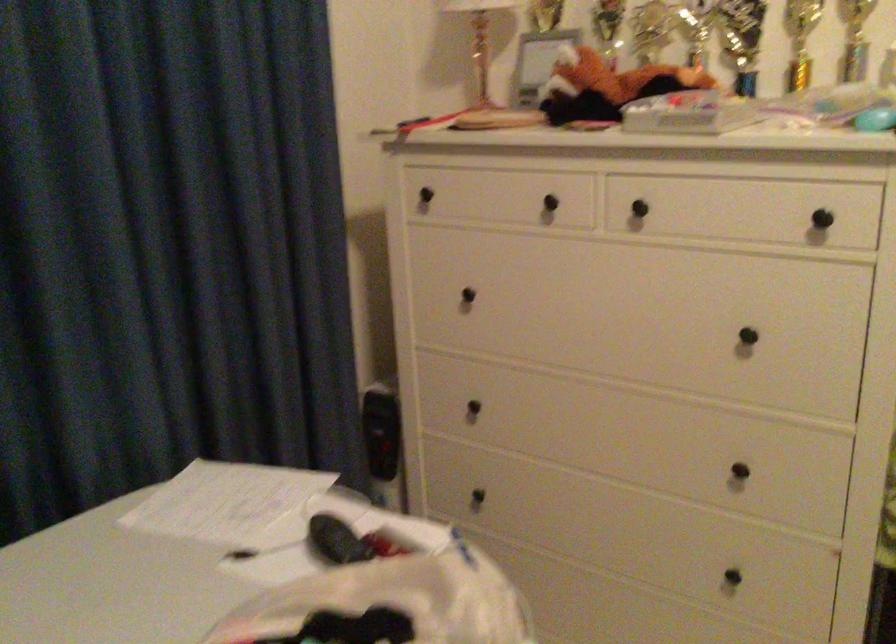
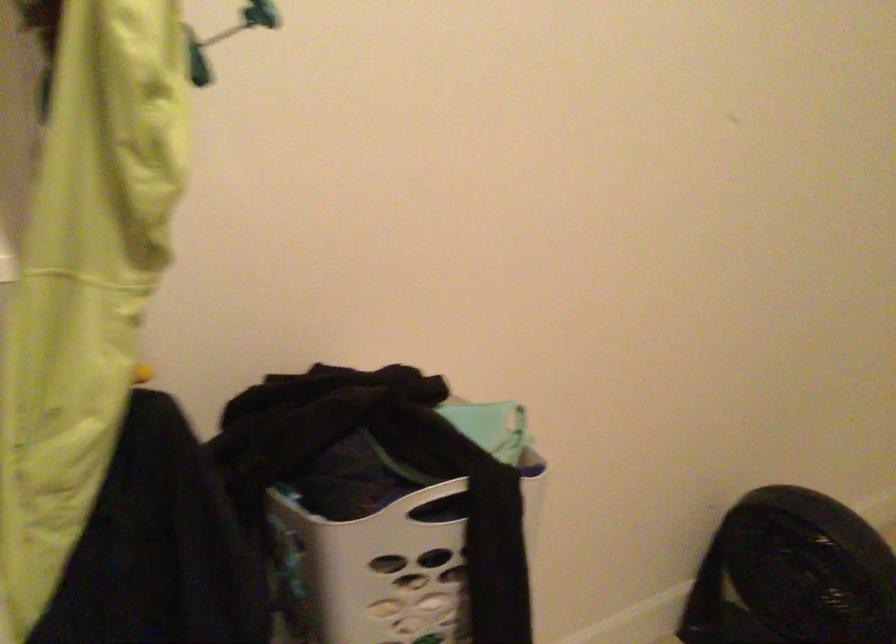
Question: The first image is from the beginning of the video and the second image is from the end. How did the camera likely rotate when shooting the video?

Choices:
 (A) Left
 (B) Right
 (C) Up
 (D) Down

Answer: (B)